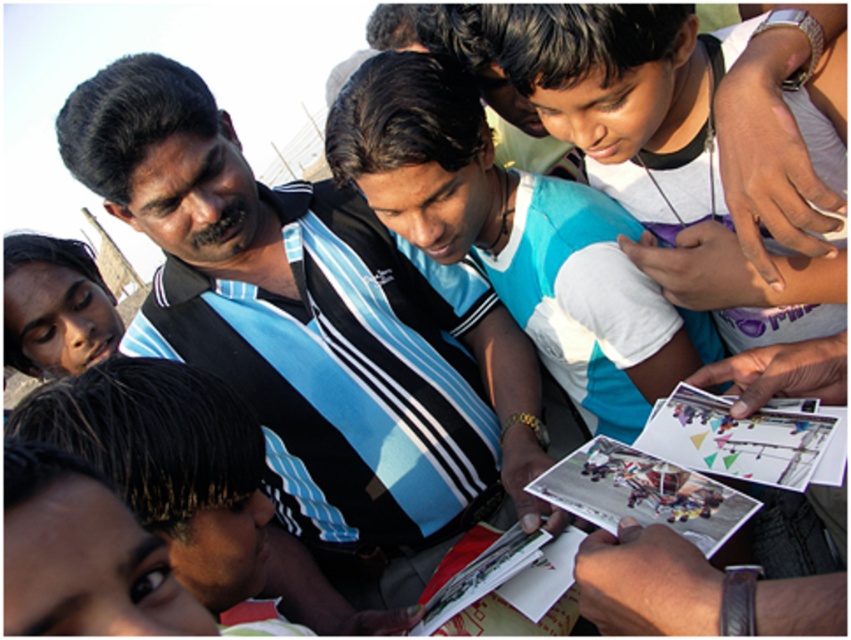
Question: Can you confirm if printed paper postcards at center is positioned above printed paper postcard at center?

Choices:
 (A) no
 (B) yes

Answer: (B)

Question: Which point is farther to the camera?

Choices:
 (A) (697, 440)
 (B) (286, 300)
 (C) (671, 502)

Answer: (B)

Question: Can you confirm if black striped shirt at center is positioned to the right of printed paper postcard at center?

Choices:
 (A) no
 (B) yes

Answer: (A)

Question: Which point is closer to the camera?

Choices:
 (A) printed paper postcards at center
 (B) black striped shirt at center

Answer: (A)

Question: In this image, where is printed paper postcards at center located relative to printed paper postcard at center?

Choices:
 (A) above
 (B) below

Answer: (A)

Question: Which of the following is the closest to the observer?

Choices:
 (A) printed paper postcard at center
 (B) black striped shirt at center
 (C) printed paper postcards at center

Answer: (A)